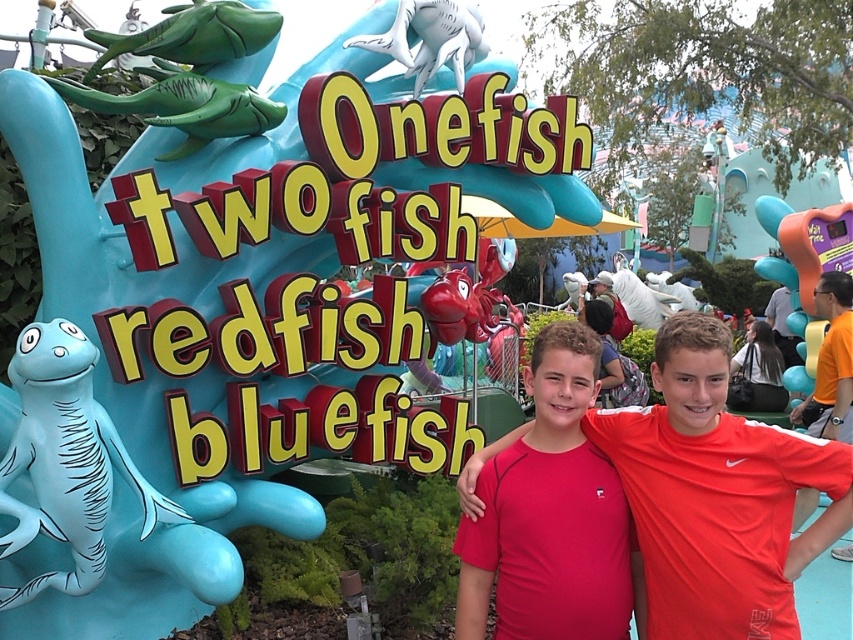
Can you confirm if red matte shirt at center is positioned above pink fabric shirt at center?

Yes, red matte shirt at center is above pink fabric shirt at center.

Which is behind, point (813, 449) or point (590, 618)?

Positioned behind is point (590, 618).

The height and width of the screenshot is (640, 853). I want to click on red matte shirt at center, so click(x=717, y=493).